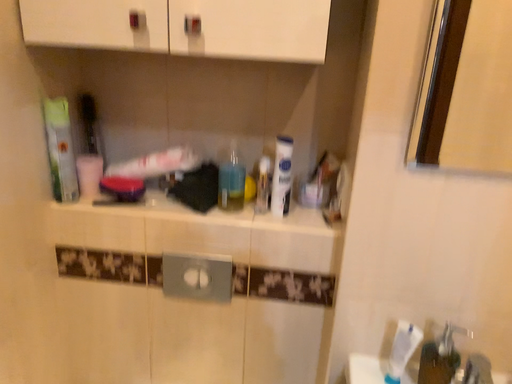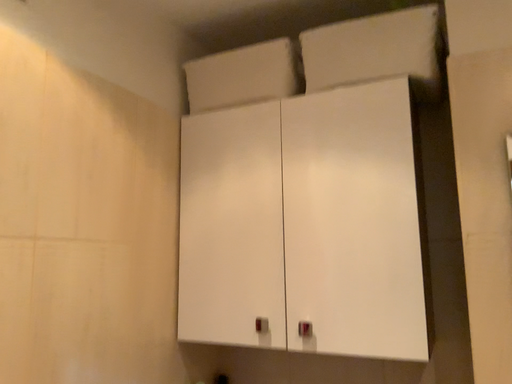
Question: How did the camera likely rotate when shooting the video?

Choices:
 (A) rotated downward
 (B) rotated upward

Answer: (B)